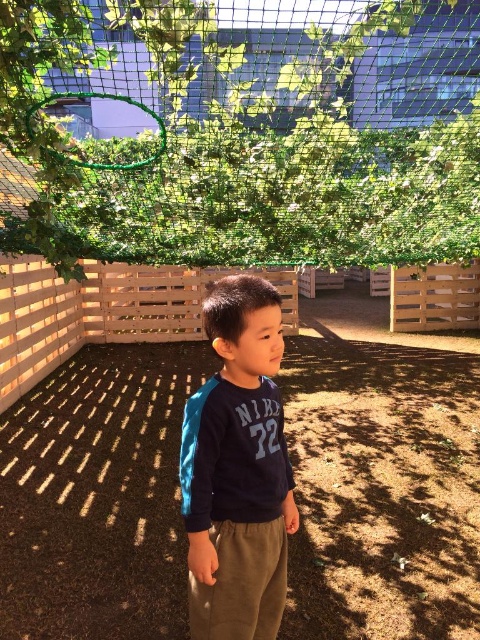
Does green mesh netting at upper center appear on the left side of navy blue sweatshirt at center?

Yes, green mesh netting at upper center is to the left of navy blue sweatshirt at center.

Is green mesh netting at upper center smaller than navy blue sweatshirt at center?

No.

Who is more distant from viewer, (298, 40) or (260, 547)?

Point (298, 40)

Image resolution: width=480 pixels, height=640 pixels. Identify the location of green mesh netting at upper center. (259, 140).

Can you confirm if navy blue sweatshirt at center is positioned above wooden fence at center?

Actually, navy blue sweatshirt at center is below wooden fence at center.

Between point (206, 381) and point (136, 316), which one is positioned behind?

Point (136, 316)

Does point (216, 285) lie in front of point (2, 346)?

Yes, point (216, 285) is closer to viewer.

This screenshot has width=480, height=640. I want to click on navy blue sweatshirt at center, so click(238, 470).

You are a GUI agent. You are given a task and a screenshot of the screen. Output one action in this format:
    pyautogui.click(x=<x>, y=<y>)
    Task: Click on the green mesh netting at upper center
    
    Given the screenshot: What is the action you would take?
    pyautogui.click(x=259, y=140)

Is green mesh netting at upper center taller than wooden fence at center?

Correct, green mesh netting at upper center is much taller as wooden fence at center.

Locate an element on the screen. The width and height of the screenshot is (480, 640). green mesh netting at upper center is located at coordinates (259, 140).

Locate an element on the screen. green mesh netting at upper center is located at coordinates (259, 140).